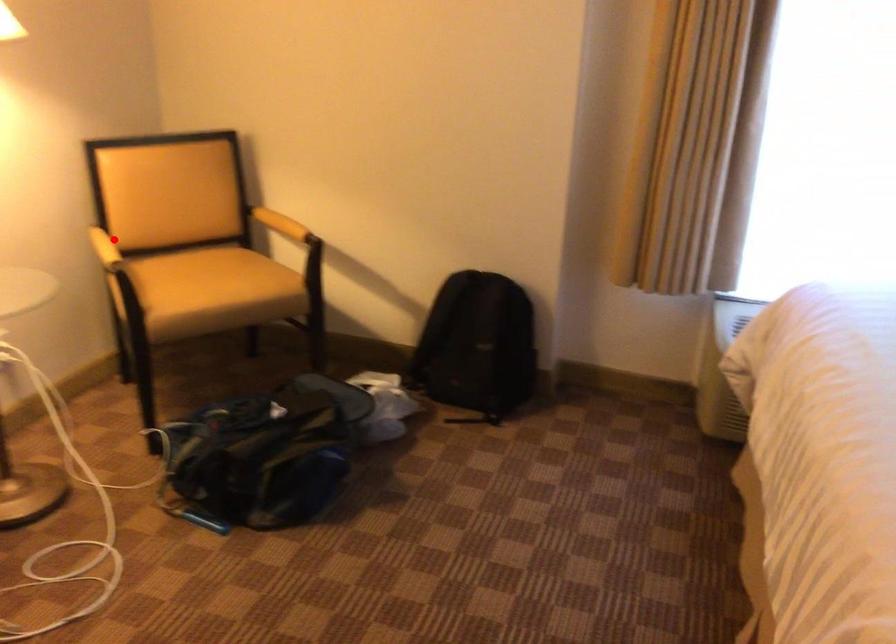
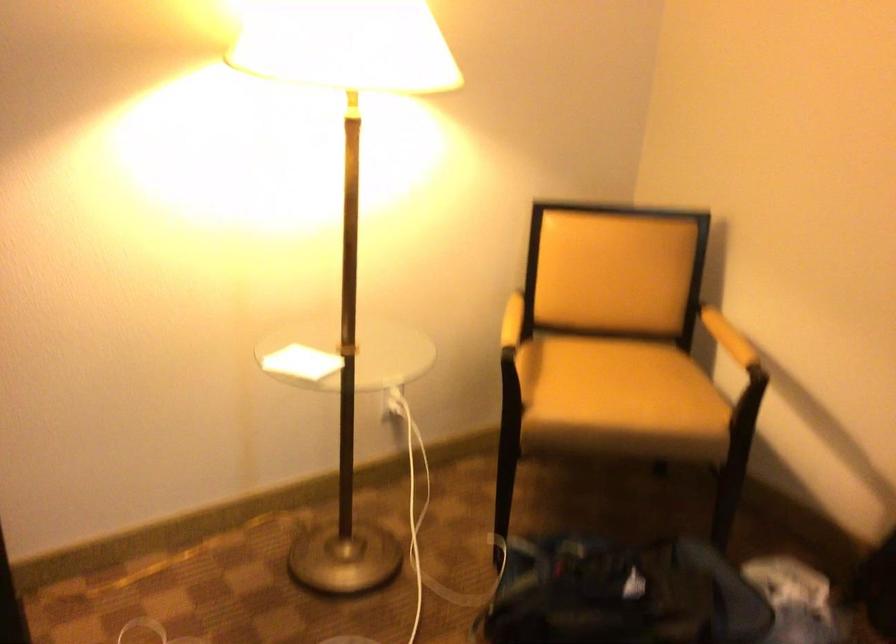
Question: I am providing you with two images of the same scene from different viewpoints. In image1, a red point is highlighted. Considering the same 3D point in image2, which of the following is correct?

Choices:
 (A) It is closer
 (B) It is farther

Answer: (A)